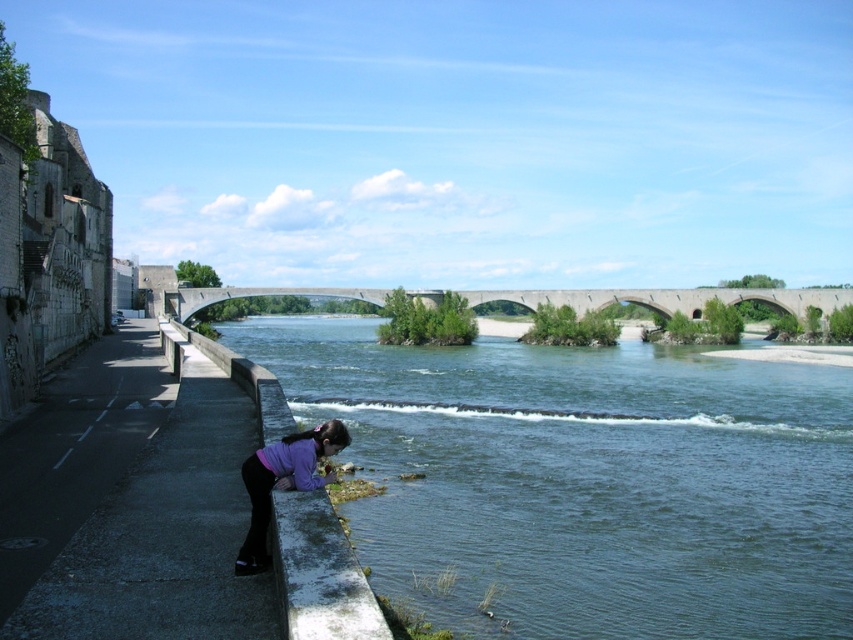
You are standing on the riverside pathway and want to cross to the other side. The concrete bridge at center and the purple matte shirt at lower center are in your line of sight. Which object is closer to you, the observer?

The purple matte shirt at lower center is closer to you because the concrete bridge at center is positioned to its right, meaning it is further away in the scene.

You are standing at a point equidistant between point (270, 288) and point (248, 534). If you look towards the river, which point would appear closer to you?

Point (270, 288) is further to the camera than point (248, 534), so when looking towards the river, point (248, 534) would appear closer to you.